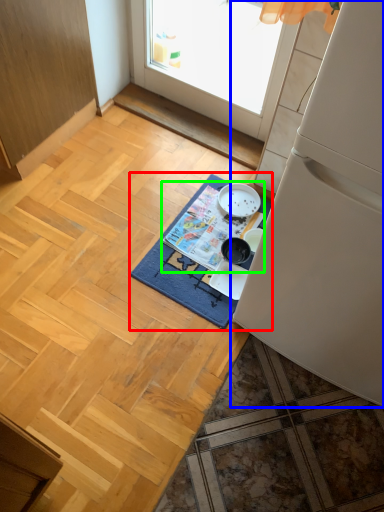
Question: Estimate the real-world distances between objects in this image. Which object is closer to mat (highlighted by a red box), refrigerator (highlighted by a blue box) or magazine (highlighted by a green box)?

Choices:
 (A) refrigerator
 (B) magazine

Answer: (B)